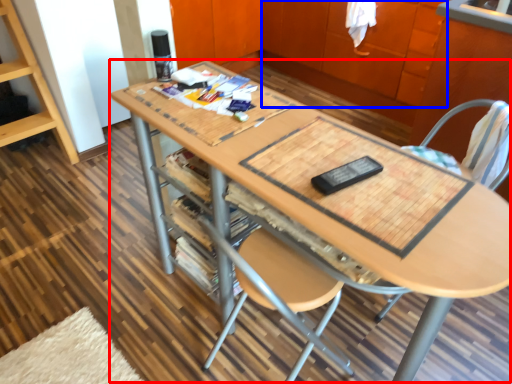
Question: Which point is further to the camera, table (highlighted by a red box) or cabinetry (highlighted by a blue box)?

Choices:
 (A) table
 (B) cabinetry

Answer: (B)